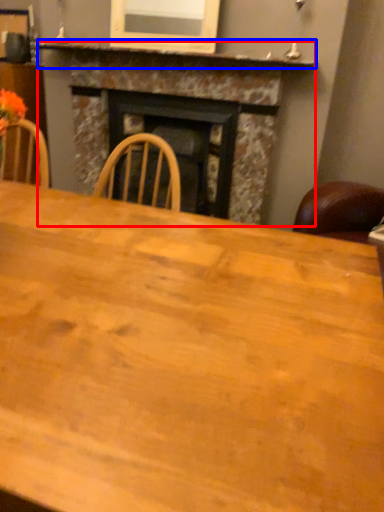
Question: Which object appears farthest to the camera in this image, fireplace (highlighted by a red box) or mantle (highlighted by a blue box)?

Choices:
 (A) fireplace
 (B) mantle

Answer: (A)